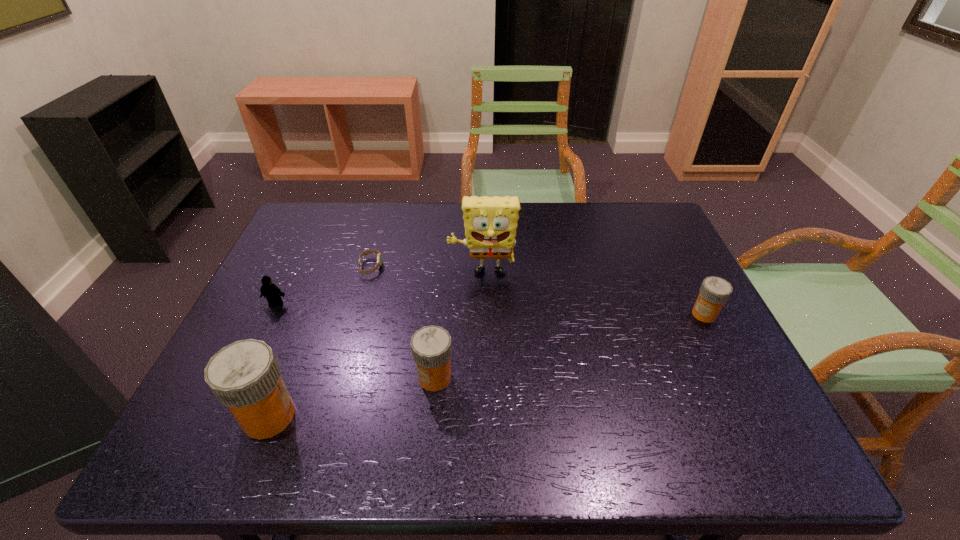
Identify the location of the fifth closest object relative to the leftmost object. (714, 292).

Image resolution: width=960 pixels, height=540 pixels. In order to click on the closest medicine to the third tallest object in this screenshot , I will do `click(245, 376)`.

This screenshot has height=540, width=960. Identify the location of medicine that is the second closest one to the fifth object from right to left. (714, 292).

Locate an element on the screen. vacant position in the image that satisfies the following two spatial constraints: 1. on the face of the third object from left to right; 2. on the face of the leftmost object is located at coordinates pyautogui.click(x=360, y=304).

I want to click on vacant position in the image that satisfies the following two spatial constraints: 1. on the face of the sponge; 2. on the label side of the fifth shortest object, so click(483, 416).